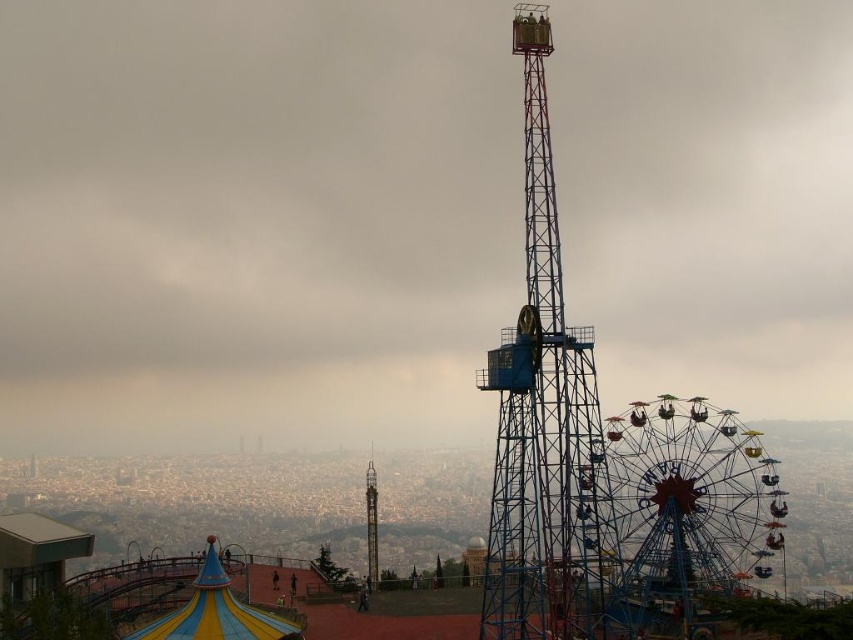
Question: Can you confirm if metallic ferris wheel at center is positioned above blue metallic tower at center?

Choices:
 (A) yes
 (B) no

Answer: (B)

Question: Estimate the real-world distances between objects in this image. Which object is closer to the blue metallic tower at center?

Choices:
 (A) metallic ferris wheel at center
 (B) metallic blue ferris wheel at right
 (C) metallic blue tower at center

Answer: (B)

Question: Observing the image, what is the correct spatial positioning of metallic ferris wheel at center in reference to blue metallic tower at center?

Choices:
 (A) left
 (B) right

Answer: (A)

Question: Based on their relative distances, which object is nearer to the metallic blue tower at center?

Choices:
 (A) metallic ferris wheel at center
 (B) metallic blue ferris wheel at right
 (C) blue metallic tower at center

Answer: (A)

Question: Does blue metallic tower at center appear on the left side of metallic blue ferris wheel at right?

Choices:
 (A) no
 (B) yes

Answer: (B)

Question: Which of these objects is positioned closest to the metallic ferris wheel at center?

Choices:
 (A) metallic blue ferris wheel at right
 (B) blue metallic tower at center
 (C) metallic blue tower at center

Answer: (C)